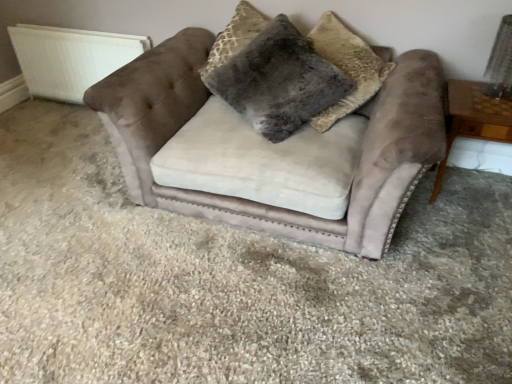
At what (x,y) coordinates should I click in order to perform the action: click on vacant space in wooden side table at right (from a real-world perspective). Please return your answer as a coordinate pair (x, y). The height and width of the screenshot is (384, 512). Looking at the image, I should click on (468, 200).